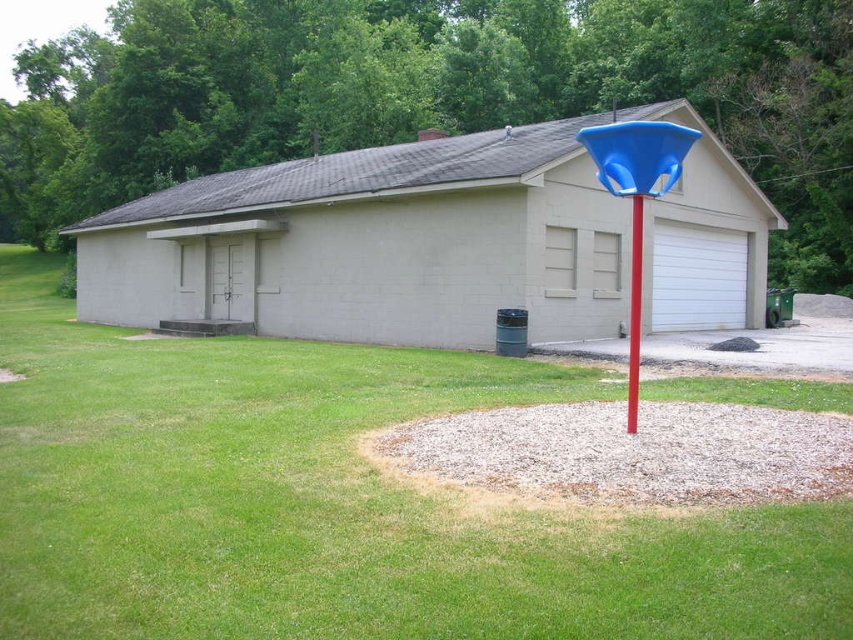
Based on the photo, you are a maintenance worker inspecting the property. You notice the matte concrete garage at center and the blue plastic pole at center. Which object is located higher in elevation?

The matte concrete garage at center is positioned over the blue plastic pole at center, so the garage is higher in elevation than the pole.

You are a maintenance worker who needs to mow the lawn around the green grass at center and the blue plastic pole at center. Which area requires attention first based on their current heights?

The green grass at center is shorter than the blue plastic pole at center, so you should mow the green grass at center first to ensure it doesn not grow taller than the pole.

You are standing at the entrance of the building and want to place a 5 meter long banner between the green grass at center and the blue plastic pole at center. Is there enough space to stretch the banner between them?

The distance between the green grass at center and the blue plastic pole at center is 5.14 meters, so the 5 meter long banner can be stretched between them as there is sufficient space.